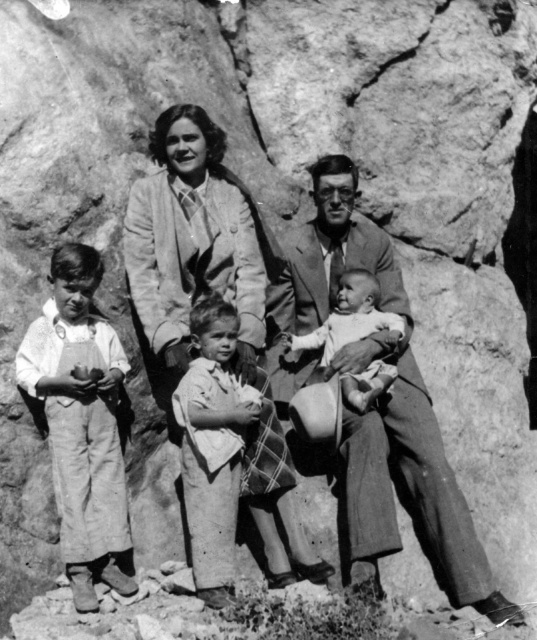
Question: Which point is closer to the camera?

Choices:
 (A) (185, 184)
 (B) (378, 461)
 (C) (279, 484)

Answer: (B)

Question: Does matte fabric coat at center have a smaller size compared to light brown cotton dress at center?

Choices:
 (A) yes
 (B) no

Answer: (B)

Question: Can you confirm if smooth fabric suit at right is wider than matte fabric coat at center?

Choices:
 (A) no
 (B) yes

Answer: (B)

Question: Which point is closer to the camera?

Choices:
 (A) (171, 129)
 (B) (60, 381)

Answer: (B)

Question: Which point is closer to the camera taking this photo?

Choices:
 (A) (64, 296)
 (B) (293, 577)
 (C) (355, 282)
 (D) (243, 372)

Answer: (A)

Question: Can you confirm if white cotton shirt at left is wider than smooth skin baby at center?

Choices:
 (A) no
 (B) yes

Answer: (A)